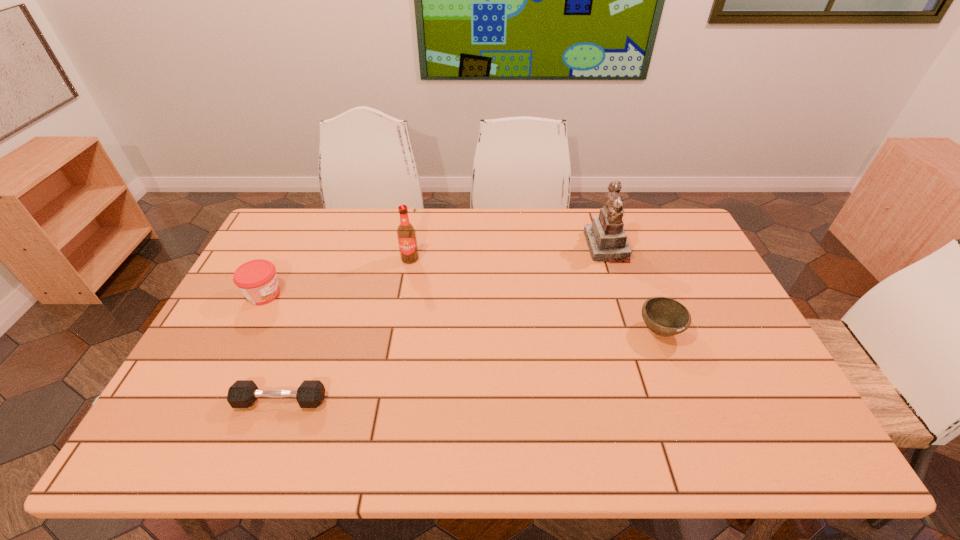
In the image, there is a desktop. At what (x,y) coordinates should I click in order to perform the action: click on vacant space at the left edge. Please return your answer as a coordinate pair (x, y). Looking at the image, I should click on 256,349.

Locate an element on the screen. This screenshot has width=960, height=540. vacant space at the right edge of the desktop is located at coordinates click(x=681, y=296).

Find the location of `free space at the far left corner of the desktop`. free space at the far left corner of the desktop is located at coordinates (299, 249).

This screenshot has width=960, height=540. In order to click on vacant region at the far right corner of the desktop in this screenshot , I will do point(661,229).

Identify the location of vacant space at the near right corner of the desktop. The image size is (960, 540). (749, 450).

Identify the location of empty location between the figurine and the dumbbell. This screenshot has width=960, height=540. (444, 323).

At what (x,y) coordinates should I click in order to perform the action: click on blank region between the figurine and the third farthest object. Please return your answer as a coordinate pair (x, y). Looking at the image, I should click on (435, 271).

At what (x,y) coordinates should I click in order to perform the action: click on free space between the nearest object and the second tallest object. Please return your answer as a coordinate pair (x, y). This screenshot has width=960, height=540. Looking at the image, I should click on (346, 330).

Find the location of a particular element. The width and height of the screenshot is (960, 540). unoccupied position between the nearest object and the figurine is located at coordinates (444, 323).

At what (x,y) coordinates should I click in order to perform the action: click on free spot between the second nearest object and the figurine. Please return your answer as a coordinate pair (x, y). Looking at the image, I should click on (633, 288).